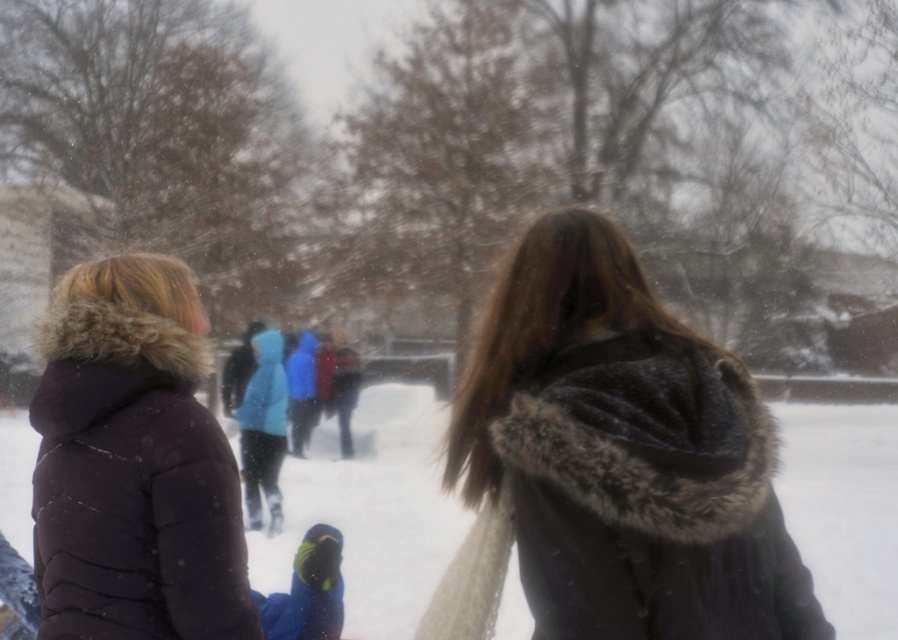
Question: Can you confirm if velvet-like dark coat at center is smaller than white fluffy snow at center?

Choices:
 (A) yes
 (B) no

Answer: (A)

Question: Does velvet-like dark coat at center have a lesser width compared to white fluffy snow at center?

Choices:
 (A) no
 (B) yes

Answer: (B)

Question: Which object appears closest to the camera in this image?

Choices:
 (A) white fluffy snow at center
 (B) velvet-like dark coat at center

Answer: (B)

Question: Is velvet-like dark coat at center smaller than white fluffy snow at center?

Choices:
 (A) no
 (B) yes

Answer: (B)

Question: Which point is farther to the camera?

Choices:
 (A) white fluffy snow at center
 (B) velvet-like dark coat at center

Answer: (A)